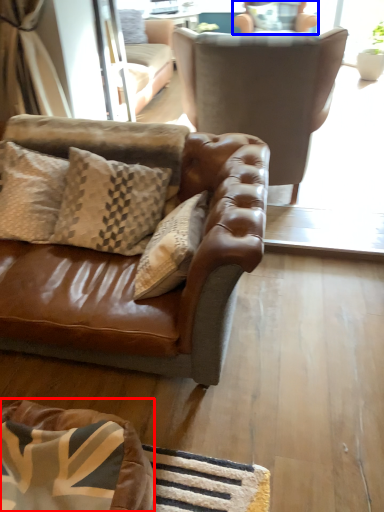
Question: Among these objects, which one is nearest to the camera, dog bed (highlighted by a red box) or chair (highlighted by a blue box)?

Choices:
 (A) dog bed
 (B) chair

Answer: (A)